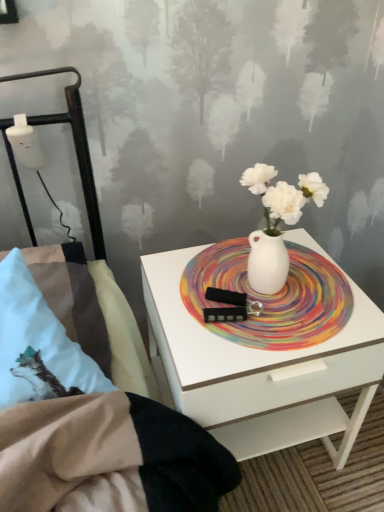
Question: In terms of height, does rainbow painted platter at center look taller or shorter compared to white plastic bottle at left?

Choices:
 (A) short
 (B) tall

Answer: (A)

Question: Considering the positions of rainbow painted platter at center and white plastic bottle at left in the image, is rainbow painted platter at center wider or thinner than white plastic bottle at left?

Choices:
 (A) thin
 (B) wide

Answer: (B)

Question: Based on their relative distances, which object is farther from the white plastic bottle at left?

Choices:
 (A) white glossy nightstand at center
 (B) rainbow painted platter at center

Answer: (A)

Question: Estimate the real-world distances between objects in this image. Which object is closer to the rainbow painted platter at center?

Choices:
 (A) white plastic bottle at left
 (B) white glossy nightstand at center

Answer: (B)